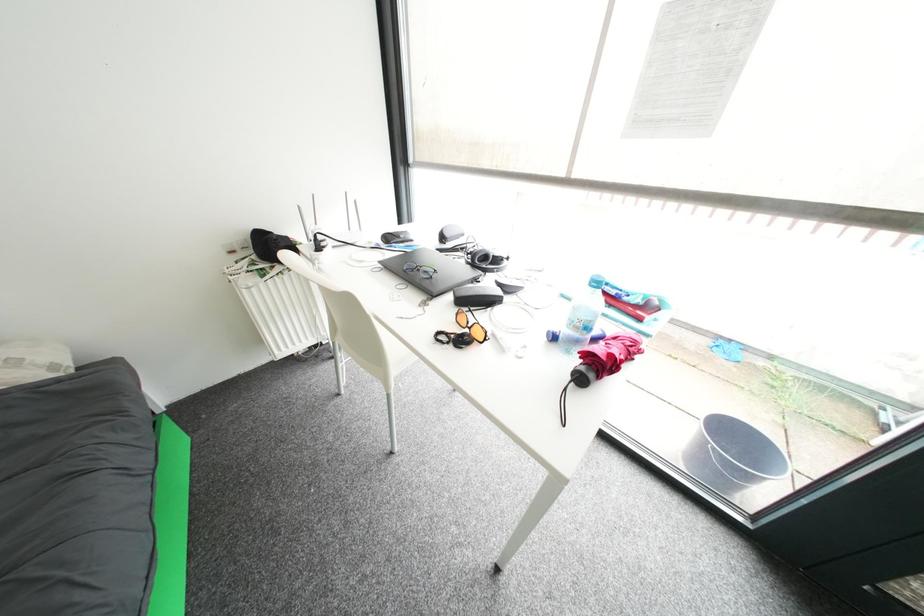
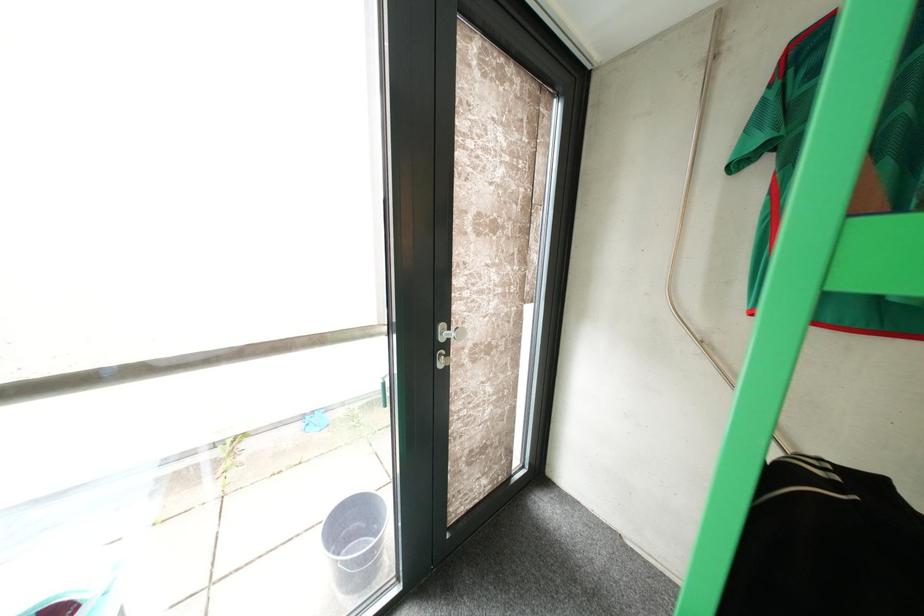
Question: The camera is either moving clockwise (left) or counter-clockwise (right) around the object. The first image is from the beginning of the video and the second image is from the end. Is the camera moving left or right when shooting the video?

Choices:
 (A) Left
 (B) Right

Answer: (A)